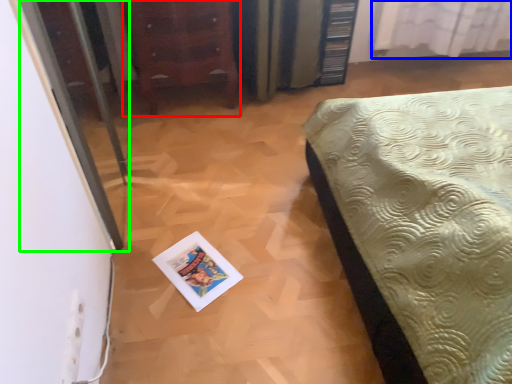
Question: Based on their relative distances, which object is nearer to furniture (highlighted by a red box)? Choose from curtain (highlighted by a blue box) and screen door (highlighted by a green box).

Choices:
 (A) curtain
 (B) screen door

Answer: (B)